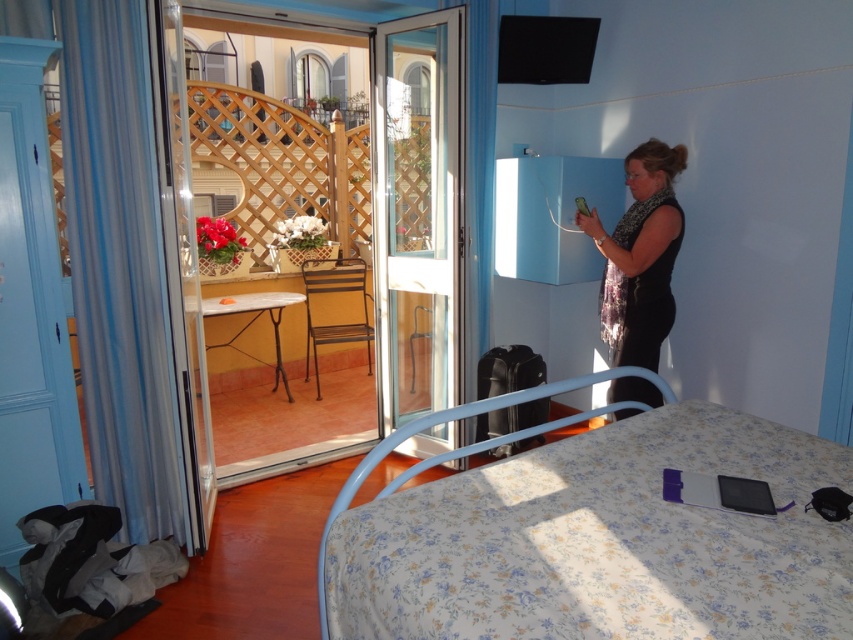
You are standing in the room and want to exit through the clear glass screen door at center. Based on the coordinates provided, can you estimate the direction you should walk to reach it?

The clear glass screen door at center is located at coordinates point [418,212], which is in the central area of the room. You should walk towards the center of the room to reach it.

You are moving a black fabric dress at center into a wardrobe that can only accommodate items narrower than the clear glass screen door at center. Will the dress fit?

The clear glass screen door at center is wider than the black fabric dress at center, so the dress will fit in the wardrobe since its width is narrower than the door.

From the picture: You are a delivery person trying to enter the apartment through the transparent glass door at center and clear glass screen door at center. Which door should you open first?

You should open the transparent glass door at center first because it is to the left of the clear glass screen door at center, so it is the outer door.